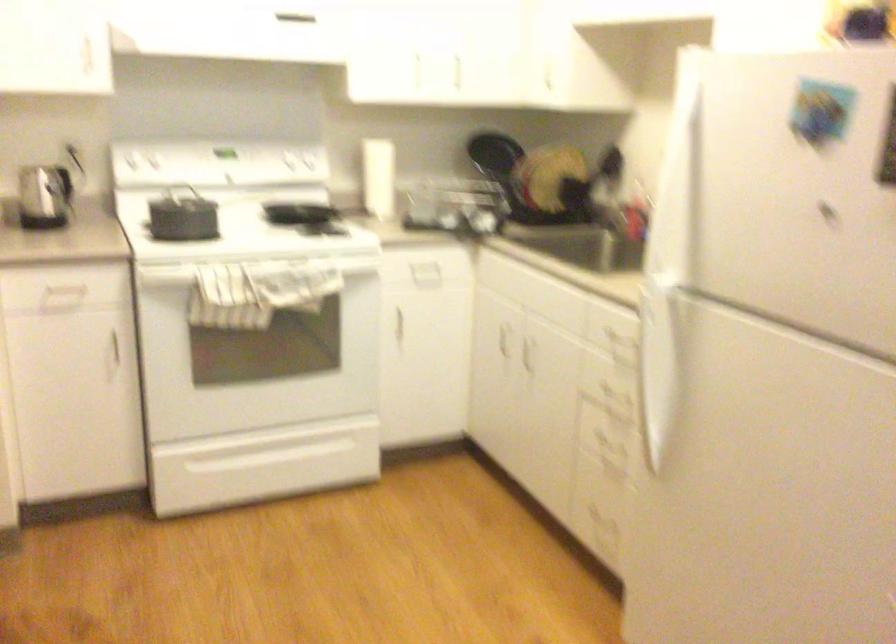
Where is `pot lid handle`? The width and height of the screenshot is (896, 644). pot lid handle is located at coordinates (141, 225).